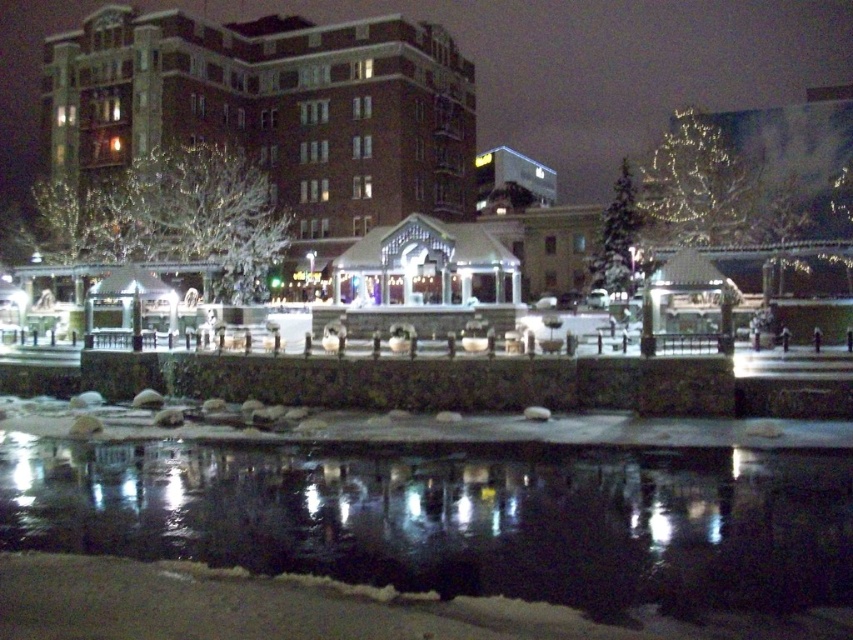
Is point (691, 509) in front of point (265, 109)?

Yes, point (691, 509) is in front of point (265, 109).

Can you confirm if black reflective water at lower center is smaller than brick building at upper center?

Yes.

This screenshot has width=853, height=640. I want to click on black reflective water at lower center, so click(457, 520).